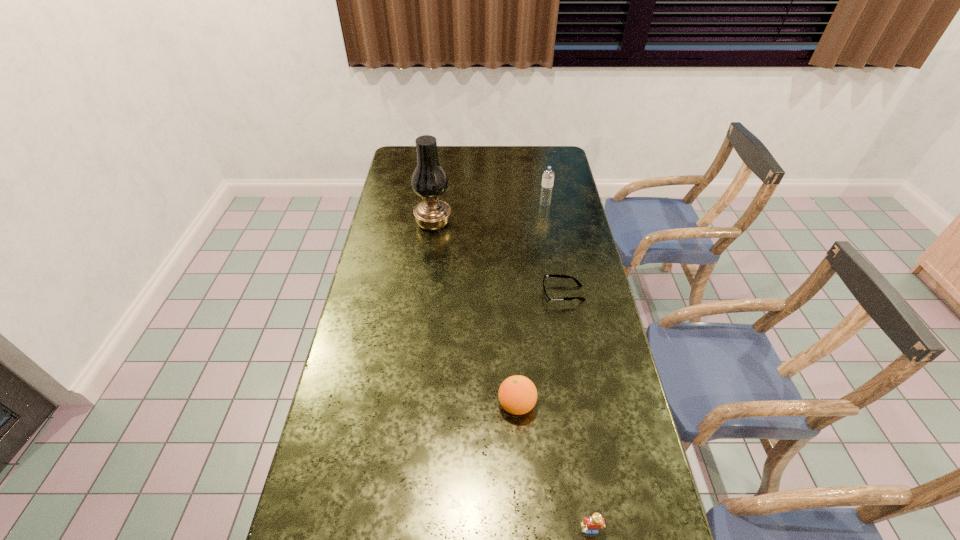
Identify the location of free spot between the fourth tallest object and the third farthest object. (577, 411).

What are the coordinates of `empty space between the fourth object from right to left and the oil lamp` in the screenshot? It's located at (475, 314).

The image size is (960, 540). What are the coordinates of `free space between the nearest object and the fourth farthest object` in the screenshot? It's located at (554, 467).

Identify the location of unoccupied position between the second shortest object and the sunglasses. The height and width of the screenshot is (540, 960). (577, 411).

Locate an element on the screen. free space between the orange and the nearest object is located at coordinates (554, 467).

You are a GUI agent. You are given a task and a screenshot of the screen. Output one action in this format:
    pyautogui.click(x=<x>, y=<y>)
    Task: Click on the object that ranks as the second closest to the Lego
    The image size is (960, 540).
    Given the screenshot: What is the action you would take?
    pyautogui.click(x=549, y=275)

Locate which object is the second closest to the leftmost object. Please provide its 2D coordinates. Your answer should be formatted as a tuple, i.e. [(x, y)], where the tuple contains the x and y coordinates of a point satisfying the conditions above.

[(549, 275)]

The height and width of the screenshot is (540, 960). Find the location of `free spot that satisfies the following two spatial constraints: 1. on the front side of the tallest object; 2. on the right side of the second nearest object`. free spot that satisfies the following two spatial constraints: 1. on the front side of the tallest object; 2. on the right side of the second nearest object is located at coordinates (412, 404).

Identify the location of vacant space that satisfies the following two spatial constraints: 1. on the front side of the fourth object from right to left; 2. on the right side of the oil lamp. (412, 404).

This screenshot has height=540, width=960. I want to click on blank area in the image that satisfies the following two spatial constraints: 1. on the front-facing side of the sunglasses; 2. on the front-facing side of the Lego, so pyautogui.click(x=606, y=530).